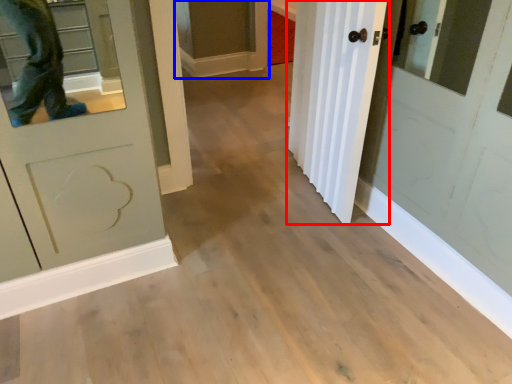
Question: Which of the following is the closest to the observer, door (highlighted by a red box) or cabinetry (highlighted by a blue box)?

Choices:
 (A) door
 (B) cabinetry

Answer: (A)